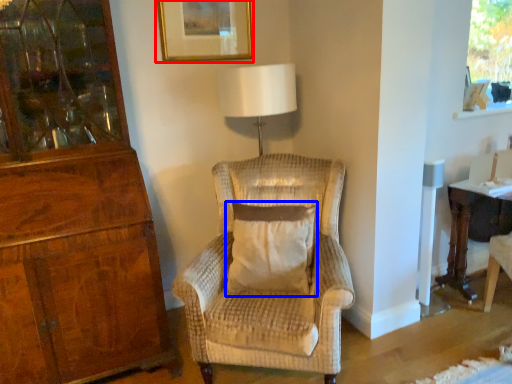
Question: Which of the following is the farthest to the observer, picture frame (highlighted by a red box) or pillow (highlighted by a blue box)?

Choices:
 (A) picture frame
 (B) pillow

Answer: (A)